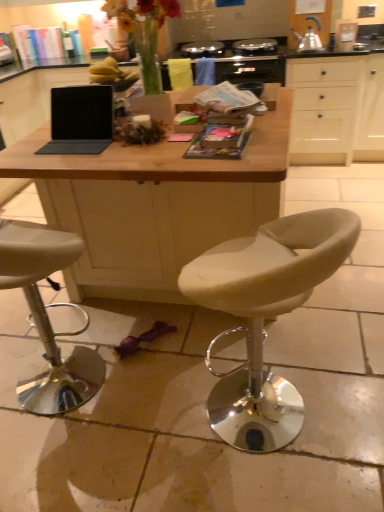
Where is `vacant space behind beige leather stool at lower left, the first chair from the left`? This screenshot has width=384, height=512. vacant space behind beige leather stool at lower left, the first chair from the left is located at coordinates (81, 324).